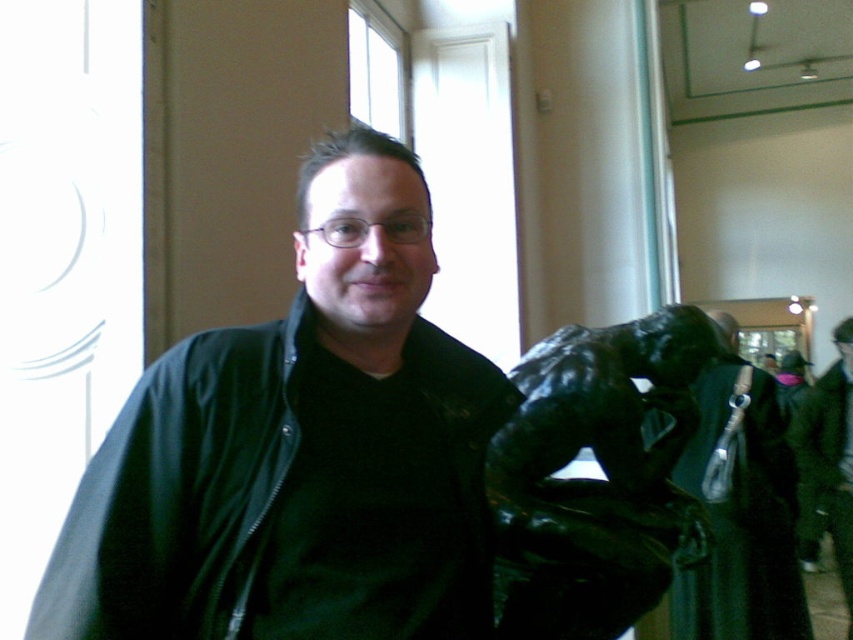
Which is behind, point (438, 497) or point (672, 394)?

The point (672, 394) is more distant.

Is point (167, 404) farther from camera compared to point (560, 540)?

No.

At what (x,y) coordinates should I click in order to perform the action: click on green matte jacket at center. Please return your answer as a coordinate pair (x, y). The image size is (853, 640). Looking at the image, I should click on (281, 499).

The width and height of the screenshot is (853, 640). What are the coordinates of `green matte jacket at center` in the screenshot? It's located at (281, 499).

Identify the location of black bronze statue at center. pyautogui.click(x=596, y=480).

Between black bronze statue at center and black matte jacket at center, which one is positioned lower?

Positioned lower is black matte jacket at center.

Describe the element at coordinates (596, 480) in the screenshot. The height and width of the screenshot is (640, 853). I see `black bronze statue at center` at that location.

Identify the location of black bronze statue at center. This screenshot has height=640, width=853. (596, 480).

Does green matte jacket at center appear over black matte jacket at center?

Yes, green matte jacket at center is above black matte jacket at center.

Which is behind, point (387, 632) or point (840, 429)?

Point (840, 429)

This screenshot has width=853, height=640. In order to click on green matte jacket at center in this screenshot , I will do `click(281, 499)`.